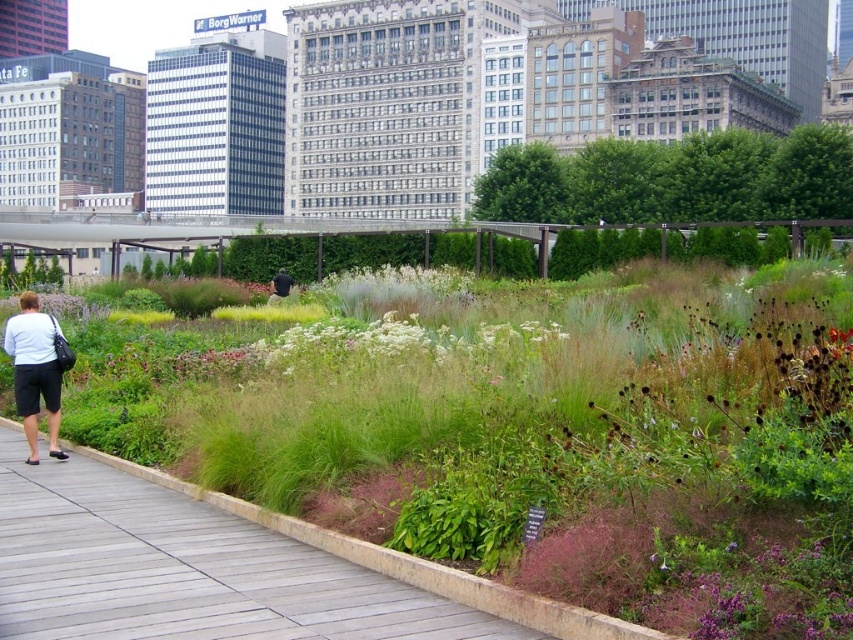
You are standing in the urban garden scene. You need to locate the wooden at left. Where exactly is it positioned in the image?

The wooden at left is positioned at point [184,570] in the image.